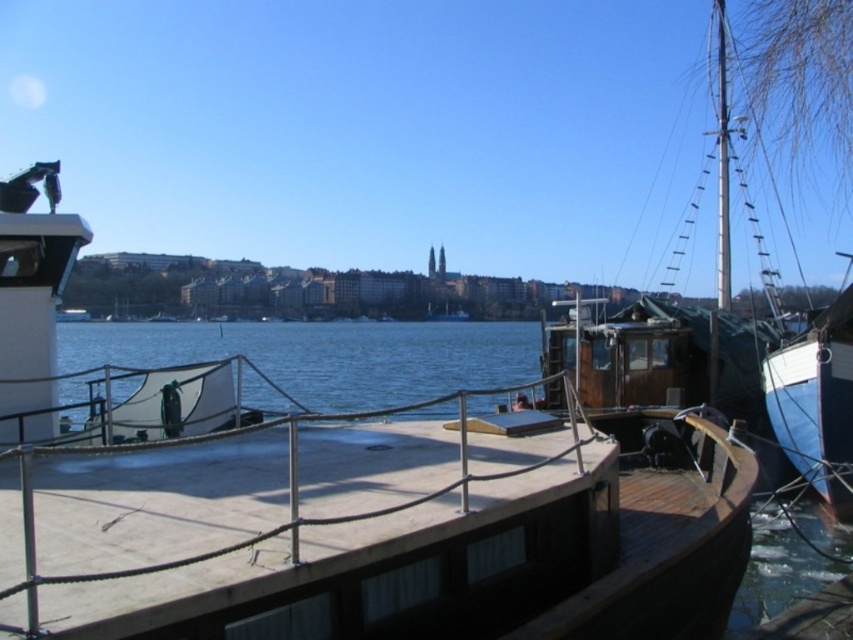
This screenshot has width=853, height=640. What do you see at coordinates (339, 500) in the screenshot? I see `wooden boat at center` at bounding box center [339, 500].

Where is `wooden boat at center`? wooden boat at center is located at coordinates (339, 500).

This screenshot has width=853, height=640. I want to click on wooden boat at center, so click(x=339, y=500).

How much distance is there between smooth wooden deck at center and blue matte boat at right?

A distance of 7.36 meters exists between smooth wooden deck at center and blue matte boat at right.

Is smooth wooden deck at center positioned behind blue matte boat at right?

No, smooth wooden deck at center is in front of blue matte boat at right.

Which is behind, point (151, 531) or point (828, 321)?

The point (828, 321) is behind.

Locate an element on the screen. The width and height of the screenshot is (853, 640). smooth wooden deck at center is located at coordinates (309, 532).

Is the position of wooden boat at center more distant than that of smooth wooden deck at center?

That is True.

Which is below, wooden boat at center or smooth wooden deck at center?

smooth wooden deck at center

This screenshot has width=853, height=640. Identify the location of wooden boat at center. (339, 500).